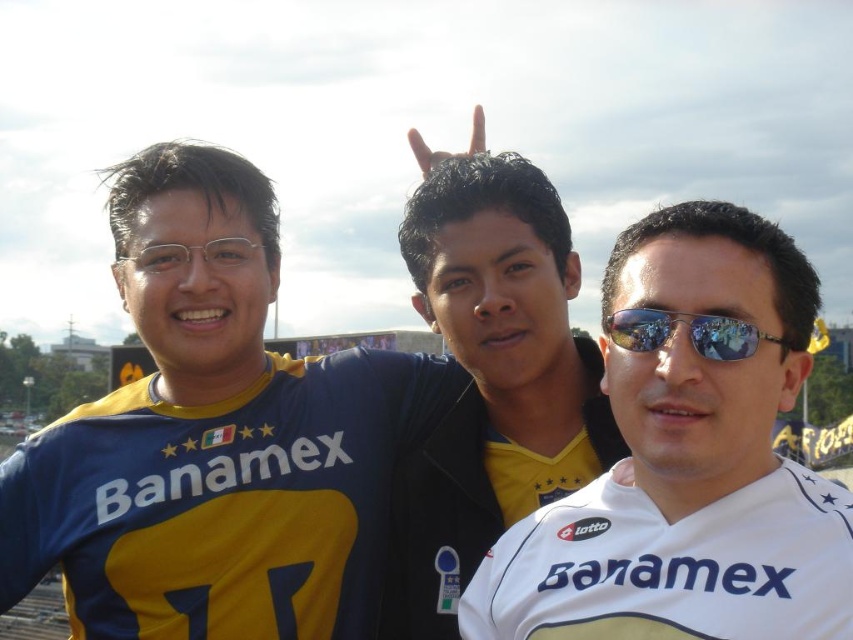
You are a photographer trying to capture a group photo of the blue jersey at left and the sunglasses at center. If you want to ensure both are fully visible in the frame, which object should you position closer to the camera?

The blue jersey at left should be positioned closer to the camera because it might be wider than the sunglasses at center, ensuring both fit within the frame.

You are a photographer standing at the center of the scene. You want to take a photo of the blue jersey at left without the sunglasses at center appearing in the frame. Is it possible given their distance?

The distance between the blue jersey at left and sunglasses at center is 25.05 meters. Since the photographer is at the center, moving slightly to the left could allow capturing the blue jersey at left while excluding the sunglasses at center due to the significant distance separating them.